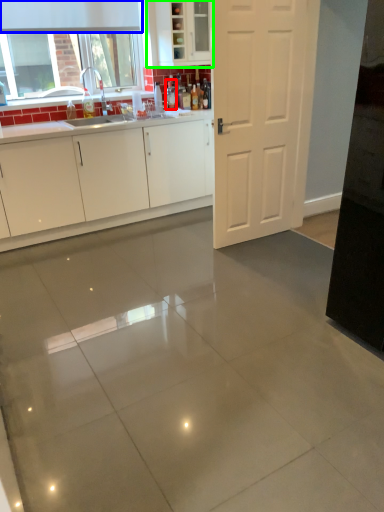
Question: Which object is positioned closest to bottle (highlighted by a red box)? Select from exhaust hood (highlighted by a blue box) and cabinetry (highlighted by a green box).

Choices:
 (A) exhaust hood
 (B) cabinetry

Answer: (B)